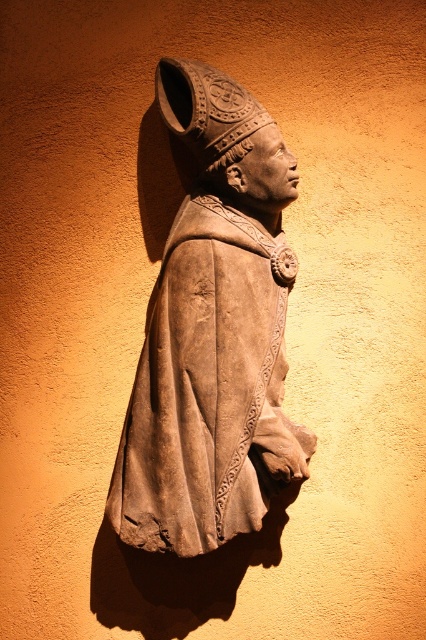
Can you confirm if brown stone statue at center is positioned to the right of brown stone head at center?

No, brown stone statue at center is not to the right of brown stone head at center.

Is point (210, 406) behind point (181, 68)?

That is False.

I want to click on brown stone statue at center, so click(213, 333).